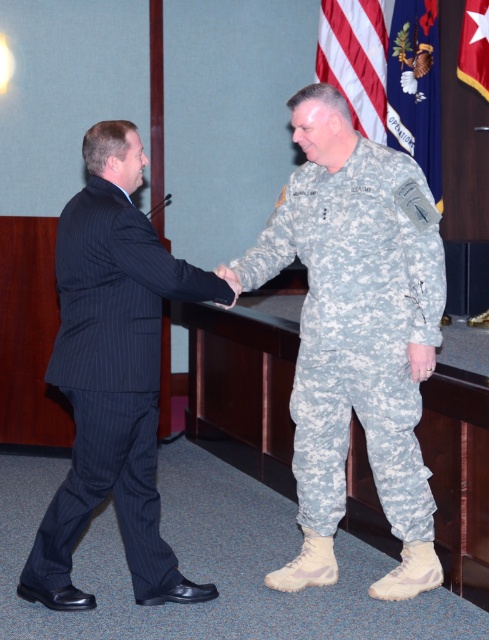
Question: Estimate the real-world distances between objects in this image. Which object is farther from the black pinstripe suit at left?

Choices:
 (A) american flag at upper center
 (B) red fabric flag at upper right
 (C) camouflage fabric uniform at center

Answer: (B)

Question: Is american flag at upper center bigger than red fabric flag at upper right?

Choices:
 (A) no
 (B) yes

Answer: (B)

Question: Which point is farther to the camera?

Choices:
 (A) silk flag at upper center
 (B) american flag at upper center
 (C) camouflage fabric uniform at center

Answer: (B)

Question: Which object appears farthest from the camera in this image?

Choices:
 (A) american flag at upper center
 (B) silk flag at upper center
 (C) camouflage fabric uniform at center
 (D) red fabric flag at upper right

Answer: (A)

Question: Can you confirm if silk flag at upper center is positioned above red fabric flag at upper right?

Choices:
 (A) no
 (B) yes

Answer: (A)

Question: Does black pinstripe suit at left have a smaller size compared to american flag at upper center?

Choices:
 (A) yes
 (B) no

Answer: (B)